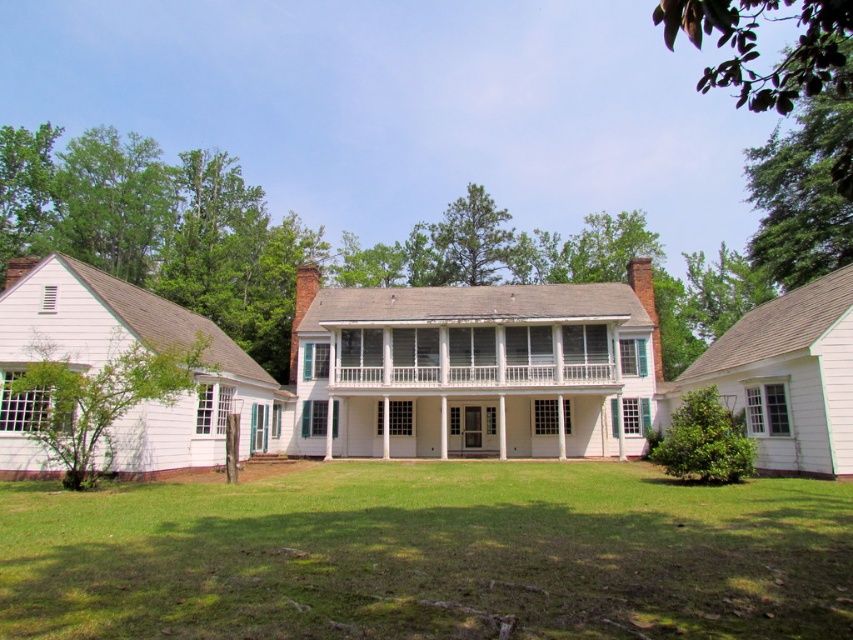
Can you confirm if green grass at center is positioned to the right of white painted wood porch at center?

Incorrect, green grass at center is not on the right side of white painted wood porch at center.

Who is more forward, (234,621) or (415,372)?

Point (234,621) is more forward.

Describe the element at coordinates (430, 556) in the screenshot. I see `green grass at center` at that location.

The image size is (853, 640). I want to click on green grass at center, so click(430, 556).